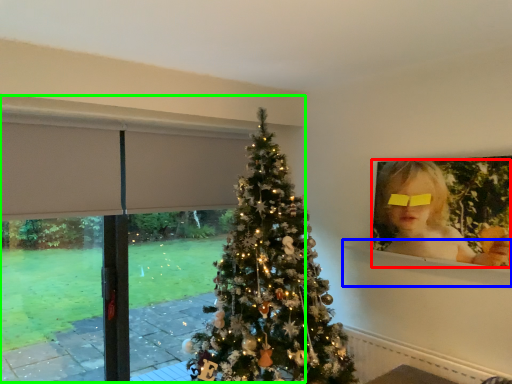
Question: Which object is the closest to the person (highlighted by a red box)? Choose among these: window sill (highlighted by a blue box) or window frame (highlighted by a green box).

Choices:
 (A) window sill
 (B) window frame

Answer: (A)